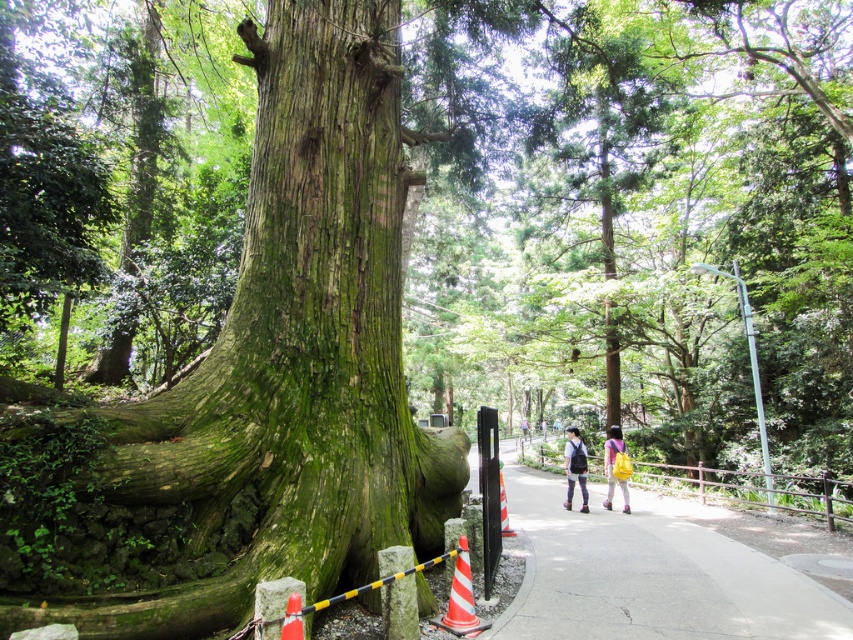
The image size is (853, 640). I want to click on green rough bark tree trunk at center, so click(273, 371).

In order to click on green rough bark tree trunk at center in this screenshot , I will do `click(273, 371)`.

Does green rough bark tree trunk at center have a greater width compared to matte black backpack at center?

Yes.

Identify the location of green rough bark tree trunk at center. (273, 371).

Which is more to the right, smooth concrete pavement at center or matte black backpack at center?

matte black backpack at center is more to the right.

Can you confirm if smooth concrete pavement at center is positioned to the left of matte black backpack at center?

Correct, you'll find smooth concrete pavement at center to the left of matte black backpack at center.

You are a GUI agent. You are given a task and a screenshot of the screen. Output one action in this format:
    pyautogui.click(x=<x>, y=<y>)
    Task: Click on the smooth concrete pavement at center
    
    Given the screenshot: What is the action you would take?
    pyautogui.click(x=648, y=573)